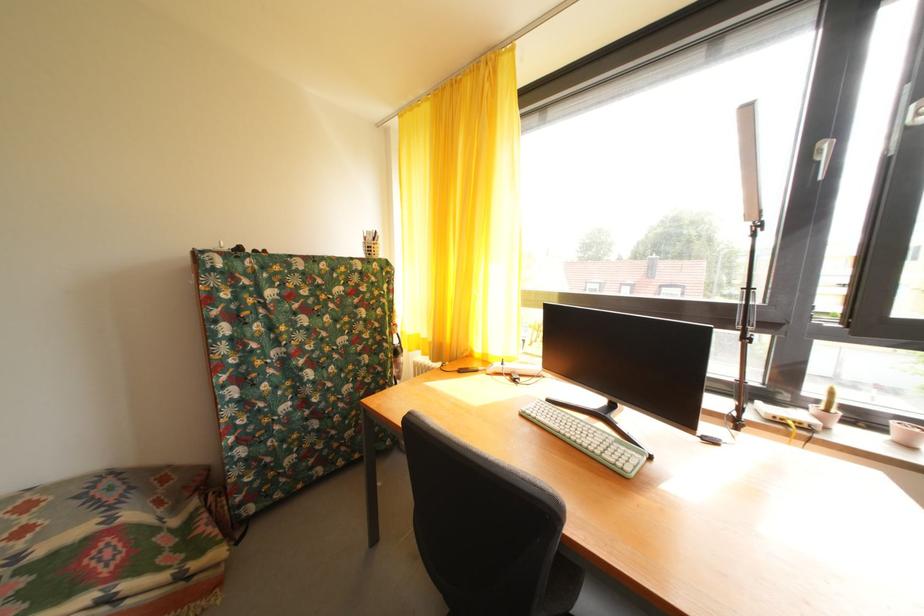
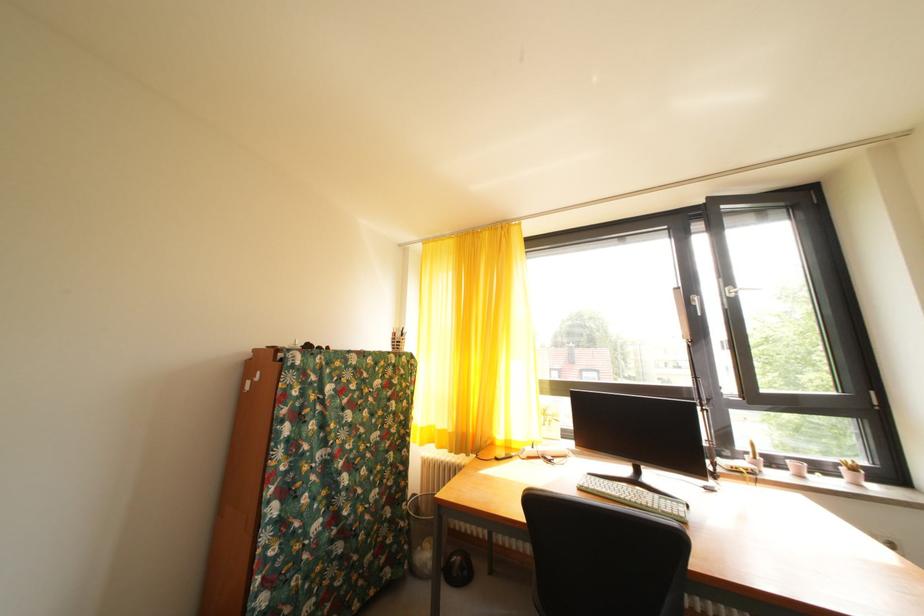
First-person continuous shooting, in which direction is the camera rotating?

The rotation direction of the camera is right-up.